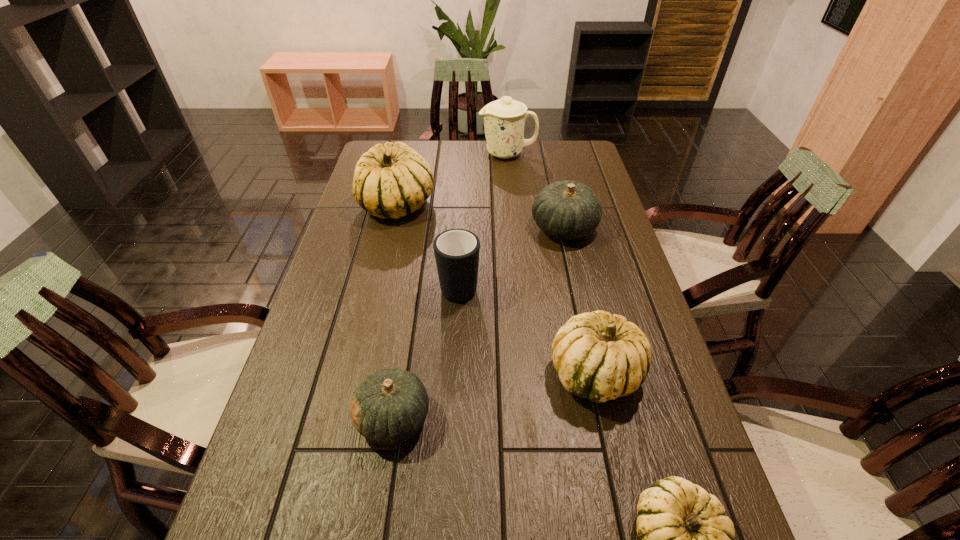
Where is `object at the left edge`? The height and width of the screenshot is (540, 960). object at the left edge is located at coordinates (392, 180).

This screenshot has width=960, height=540. In order to click on vacant space at the far edge of the desktop in this screenshot , I will do `click(446, 164)`.

This screenshot has width=960, height=540. What are the coordinates of `free space at the left edge of the desktop` in the screenshot? It's located at (331, 384).

Locate an element on the screen. The image size is (960, 540). vacant space at the right edge is located at coordinates pyautogui.click(x=612, y=225).

Locate an element on the screen. vacant region at the far left corner of the desktop is located at coordinates (373, 146).

Where is `unoccupied position between the right orange gourd and the farthest object`? The height and width of the screenshot is (540, 960). unoccupied position between the right orange gourd and the farthest object is located at coordinates (536, 191).

Identify the location of free space between the chinaware and the biggest white gourd. (452, 179).

Identify the location of empty location between the biggest white gourd and the nearer orange gourd. (396, 312).

What are the coordinates of `free space between the second smallest white gourd and the farthest white gourd` in the screenshot? It's located at (496, 289).

I want to click on the fourth closest object to the mug, so click(388, 407).